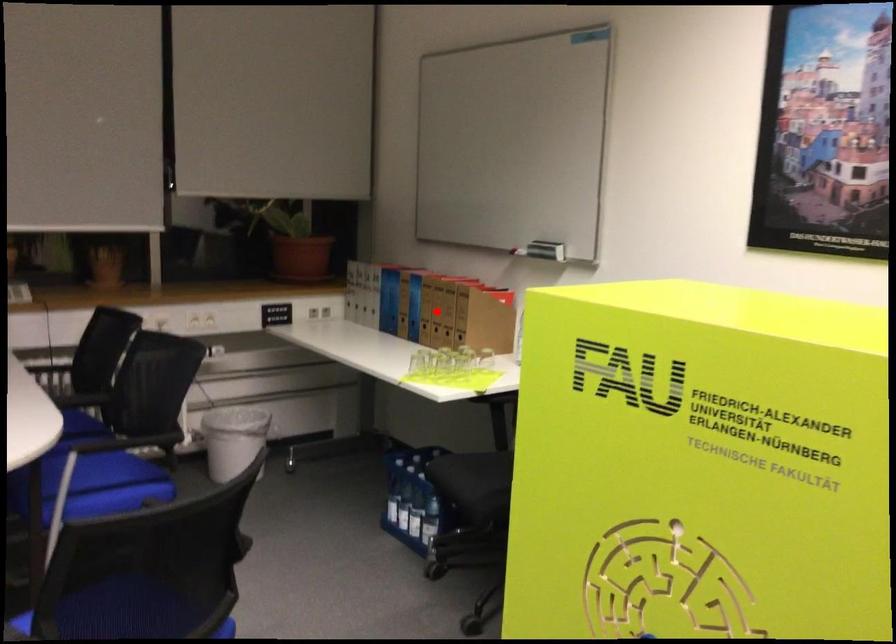
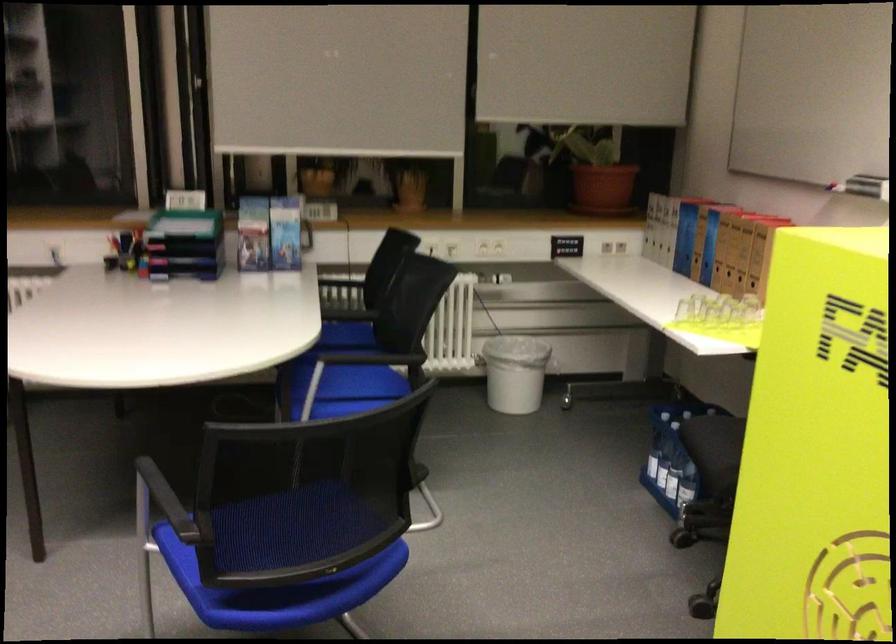
Question: I am providing you with two images of the same scene from different viewpoints. Image1 has a red point marked. In image2, the corresponding 3D location appears at what relative position? Reply with the corresponding letter.

Choices:
 (A) Closer
 (B) Farther

Answer: (A)